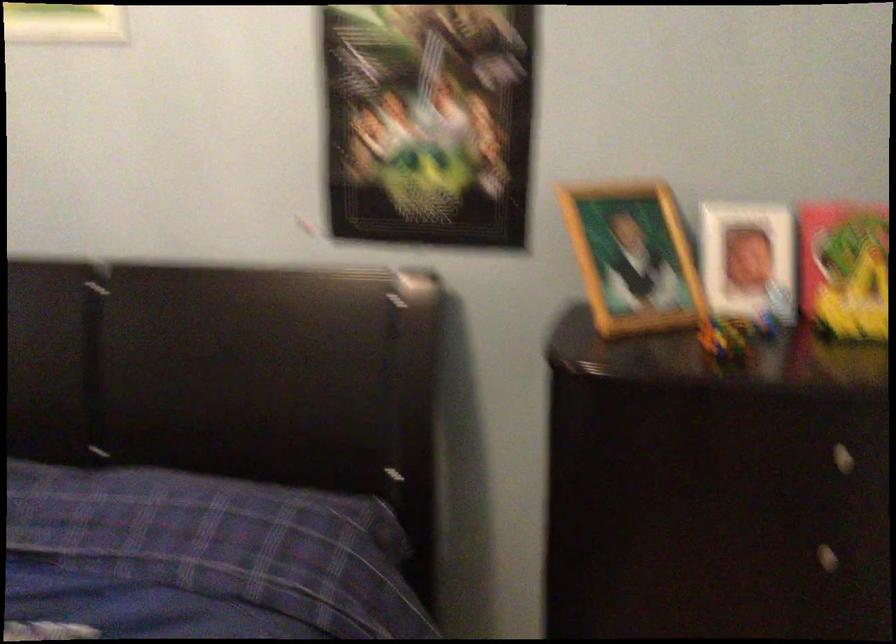
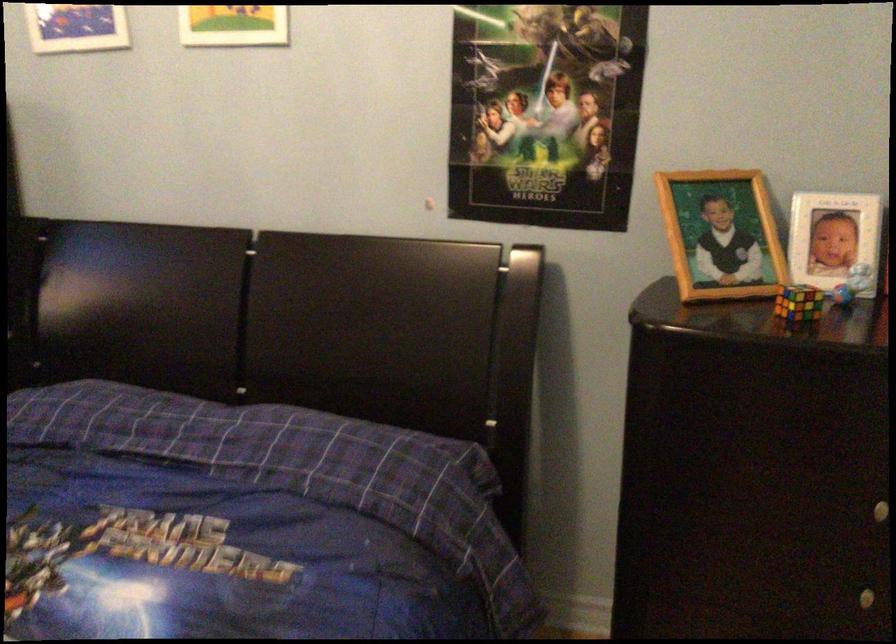
Locate, in the second image, the point that corresponds to (x=629, y=252) in the first image.

(720, 234)